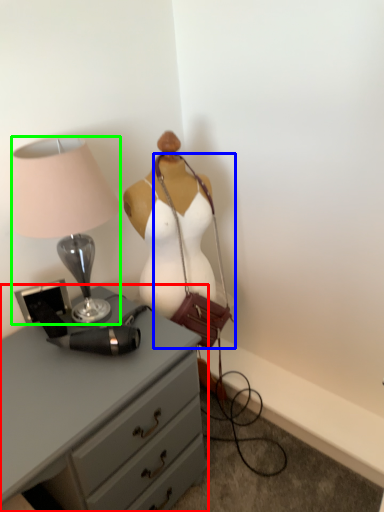
Question: Considering the real-world distances, which object is farthest from chest of drawers (highlighted by a red box)? handbag (highlighted by a blue box) or lamp (highlighted by a green box)?

Choices:
 (A) handbag
 (B) lamp

Answer: (A)